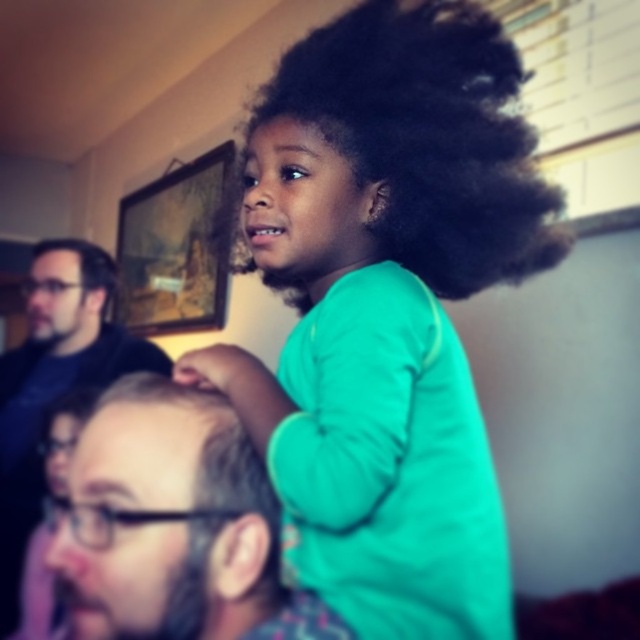
Question: Does green matte shirt at upper center have a smaller size compared to dark brown curly hair at left?

Choices:
 (A) no
 (B) yes

Answer: (A)

Question: Is green matte shirt at upper center to the left of dark brown curly hair at left from the viewer's perspective?

Choices:
 (A) yes
 (B) no

Answer: (B)

Question: Which of the following is the closest to the observer?

Choices:
 (A) matte black hair at upper center
 (B) black curly hair at upper center
 (C) dark brown curly hair at left

Answer: (A)

Question: Is green matte shirt at upper center positioned before black matte shirt at left?

Choices:
 (A) no
 (B) yes

Answer: (B)

Question: Which object is farther from the camera taking this photo?

Choices:
 (A) wooden framed artwork at upper left
 (B) dark brown curly hair at left

Answer: (A)

Question: Based on their relative distances, which object is farther from the wooden framed artwork at upper left?

Choices:
 (A) black matte shirt at left
 (B) black curly hair at upper center
 (C) dark brown curly hair at left

Answer: (B)